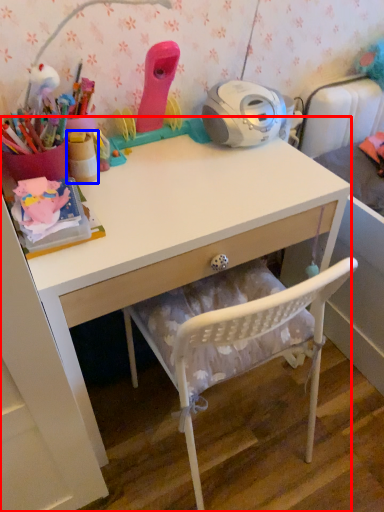
Question: Which point is closer to the camera, desk (highlighted by a red box) or stationery (highlighted by a blue box)?

Choices:
 (A) desk
 (B) stationery

Answer: (A)